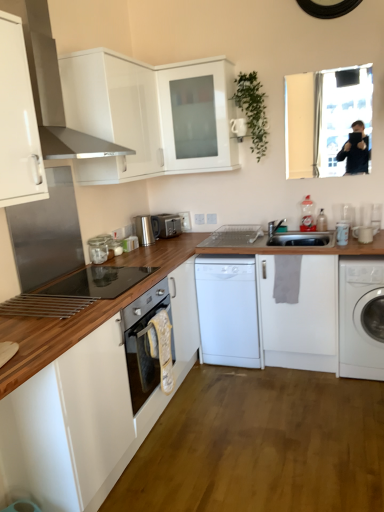
I want to click on vacant area that is situated to the right of clear glass jar at center, arranged as the 2th kitchen appliance when viewed from the back, so click(x=122, y=261).